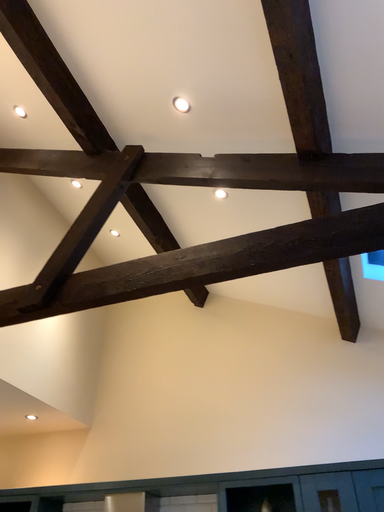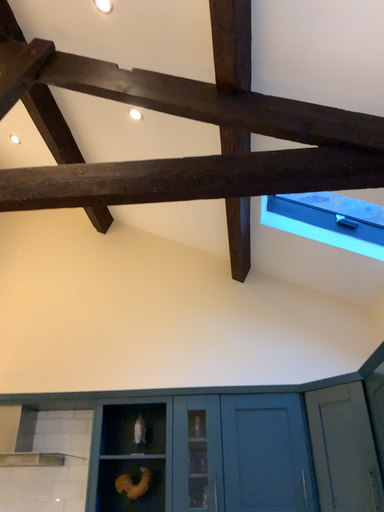
Question: Which way did the camera rotate in the video?

Choices:
 (A) rotated upward
 (B) rotated downward

Answer: (B)